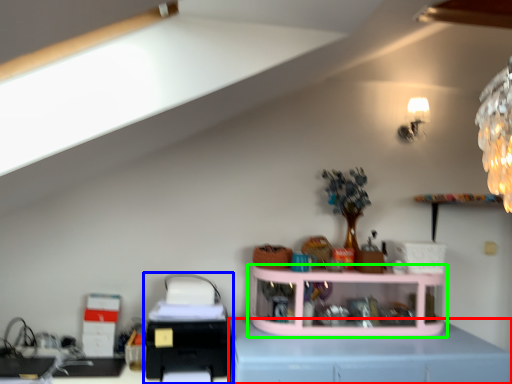
Question: Considering the real-world distances, which object is closest to computer desk (highlighted by a red box)? printer (highlighted by a blue box) or shelf (highlighted by a green box).

Choices:
 (A) printer
 (B) shelf

Answer: (B)